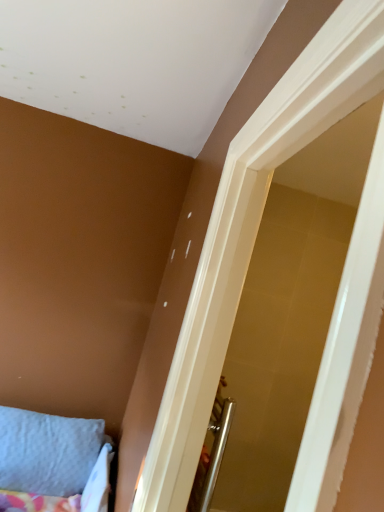
The width and height of the screenshot is (384, 512). What do you see at coordinates (53, 463) in the screenshot?
I see `light blue fabric pillow at lower left` at bounding box center [53, 463].

I want to click on light blue fabric pillow at lower left, so click(x=53, y=463).

Where is `light blue fabric pillow at lower left`? The image size is (384, 512). light blue fabric pillow at lower left is located at coordinates (53, 463).